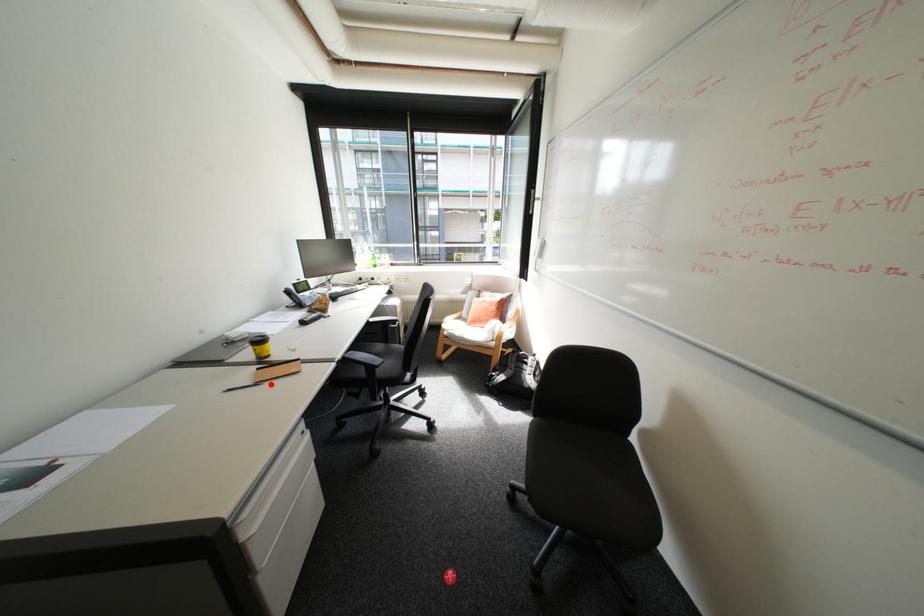
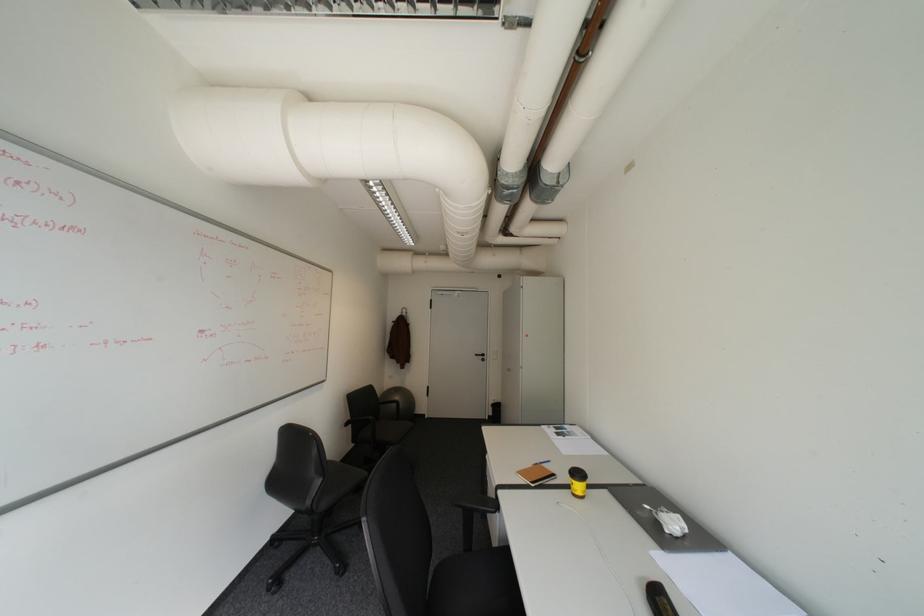
The point at the highlighted location is marked in the first image. Where is the corresponding point in the second image?

(543, 464)